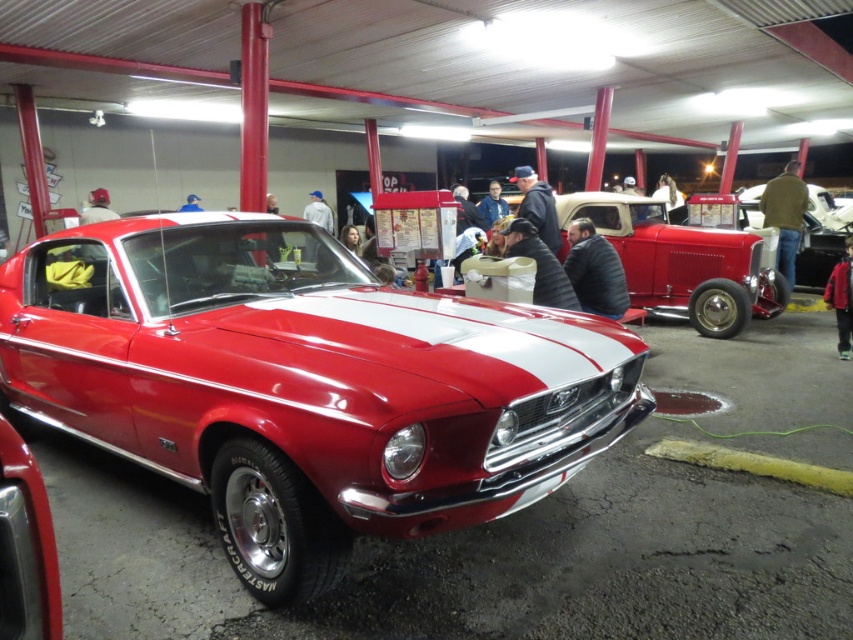
You are a photographer setting up a tripod to take a photo of the shiny red car at center and the red leather jacket at lower right. Since you want both subjects to be in focus, you need to know their height difference. Can you tell me which one is taller?

The shiny red car at center is much taller than the red leather jacket at lower right, so the car is the taller object.